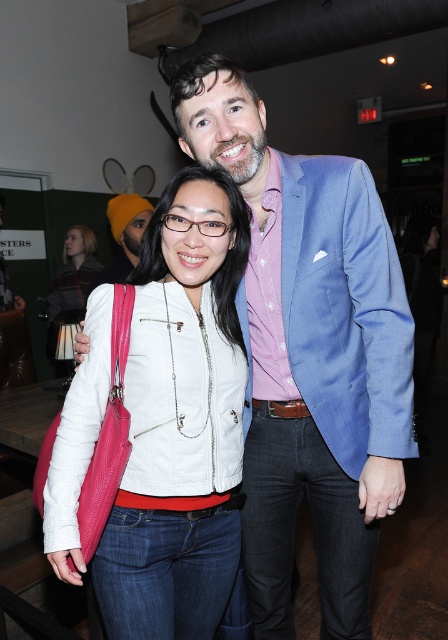
You are standing at the camera position and want to reach the point marked at coordinates point (210,410). If you take a step forward of 2 feet, will you still be 1.72 feet away from the point?

Yes, because the point (210,410) is 3.72 feet away from the camera. After taking a 2 feet step forward, you will be 1.72 feet away from the point.